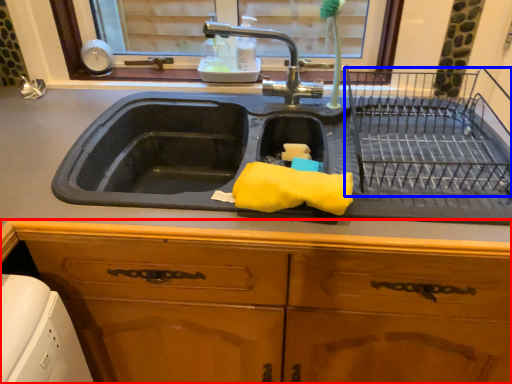
Question: Which point is further to the camera, cabinetry (highlighted by a red box) or cage (highlighted by a blue box)?

Choices:
 (A) cabinetry
 (B) cage

Answer: (A)